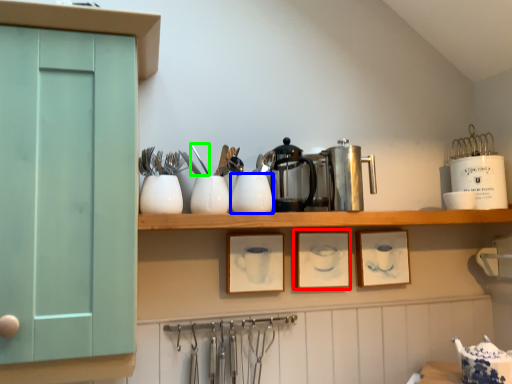
Question: Considering the real-world distances, which object is farthest from picture frame (highlighted by a red box)? tableware (highlighted by a blue box) or tableware (highlighted by a green box)?

Choices:
 (A) tableware
 (B) tableware

Answer: (B)